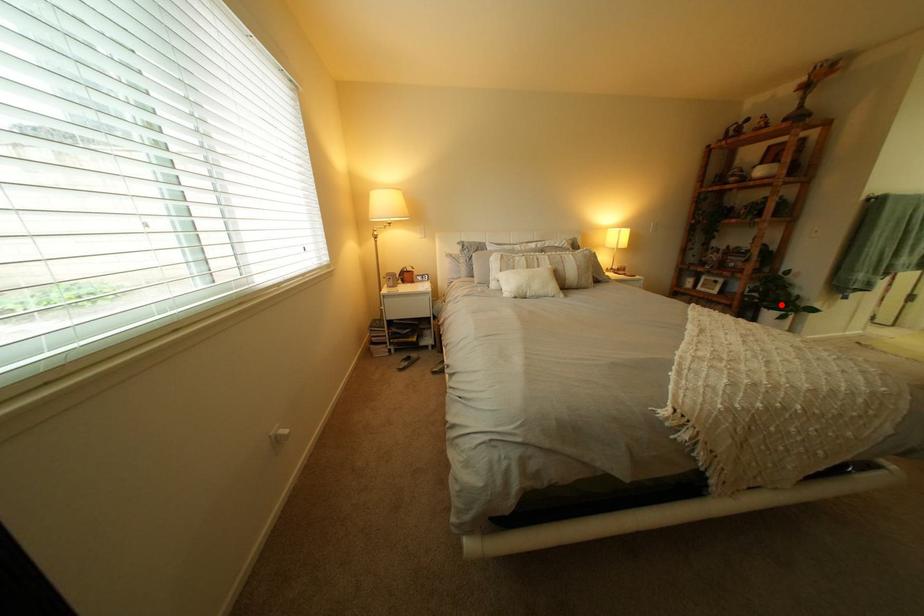
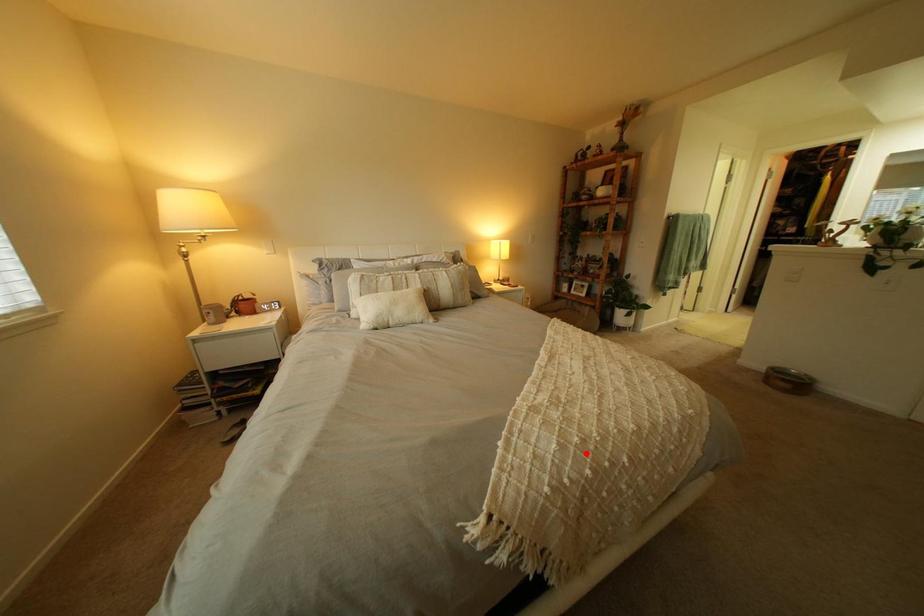
I am providing you with two images of the same scene from different viewpoints. A red point is marked on the first image and another point is marked on the second image. Is the marked point in image1 the same physical position as the marked point in image2?

No